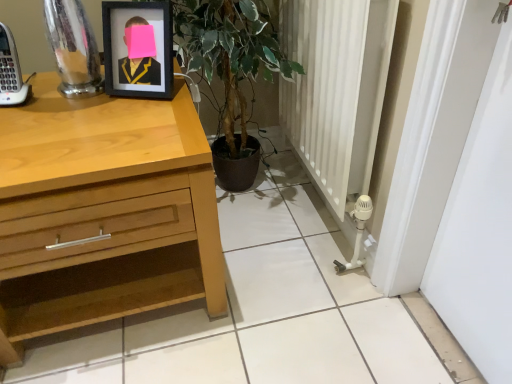
Question: Is light wood chest of drawers at left located within black matte picture frame at upper left?

Choices:
 (A) no
 (B) yes

Answer: (A)

Question: Is black matte picture frame at upper left beside light wood chest of drawers at left?

Choices:
 (A) no
 (B) yes

Answer: (A)

Question: From the image's perspective, is black matte picture frame at upper left beneath light wood chest of drawers at left?

Choices:
 (A) yes
 (B) no

Answer: (B)

Question: Can you confirm if black matte picture frame at upper left is thinner than light wood chest of drawers at left?

Choices:
 (A) yes
 (B) no

Answer: (A)

Question: Is black matte picture frame at upper left far from light wood chest of drawers at left?

Choices:
 (A) yes
 (B) no

Answer: (B)

Question: Is black matte picture frame at upper left located outside light wood chest of drawers at left?

Choices:
 (A) yes
 (B) no

Answer: (A)

Question: Does light wood chest of drawers at left have a lesser width compared to black matte picture frame at upper left?

Choices:
 (A) no
 (B) yes

Answer: (A)

Question: From the image's perspective, does light wood chest of drawers at left appear higher than black matte picture frame at upper left?

Choices:
 (A) yes
 (B) no

Answer: (B)

Question: From the image's perspective, is light wood chest of drawers at left beneath black matte picture frame at upper left?

Choices:
 (A) yes
 (B) no

Answer: (A)

Question: Is the position of light wood chest of drawers at left more distant than that of black matte picture frame at upper left?

Choices:
 (A) yes
 (B) no

Answer: (B)

Question: Is light wood chest of drawers at left completely or partially outside of black matte picture frame at upper left?

Choices:
 (A) yes
 (B) no

Answer: (A)

Question: From a real-world perspective, does light wood chest of drawers at left sit lower than black matte picture frame at upper left?

Choices:
 (A) no
 (B) yes

Answer: (B)

Question: Is black matte picture frame at upper left wider or thinner than light wood chest of drawers at left?

Choices:
 (A) thin
 (B) wide

Answer: (A)